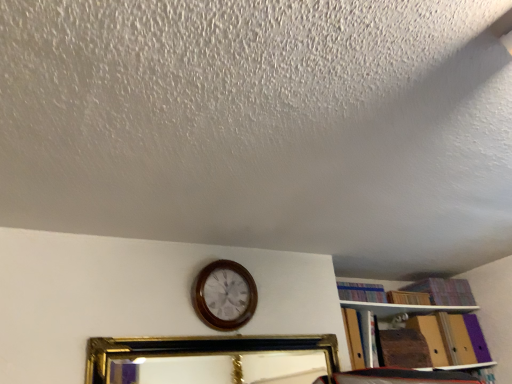
Question: Can you confirm if wooden wall clock at center is positioned to the left of striped fabric book at upper right?

Choices:
 (A) yes
 (B) no

Answer: (A)

Question: Is striped fabric book at upper right completely or partially inside wooden wall clock at center?

Choices:
 (A) yes
 (B) no

Answer: (B)

Question: From a real-world perspective, is wooden wall clock at center on top of striped fabric book at upper right?

Choices:
 (A) yes
 (B) no

Answer: (B)

Question: Considering the relative sizes of wooden wall clock at center and striped fabric book at upper right in the image provided, is wooden wall clock at center wider than striped fabric book at upper right?

Choices:
 (A) no
 (B) yes

Answer: (A)

Question: Is striped fabric book at upper right at the back of wooden wall clock at center?

Choices:
 (A) yes
 (B) no

Answer: (B)

Question: Is wooden wall clock at center closer to the viewer compared to striped fabric book at upper right?

Choices:
 (A) yes
 (B) no

Answer: (A)

Question: Is the surface of striped fabric book at upper right in direct contact with gold/gilded picture frame at center?

Choices:
 (A) no
 (B) yes

Answer: (A)

Question: Is striped fabric book at upper right completely or partially outside of gold/gilded picture frame at center?

Choices:
 (A) yes
 (B) no

Answer: (A)

Question: Is striped fabric book at upper right bigger than gold/gilded picture frame at center?

Choices:
 (A) no
 (B) yes

Answer: (A)

Question: Can you confirm if striped fabric book at upper right is wider than gold/gilded picture frame at center?

Choices:
 (A) yes
 (B) no

Answer: (B)

Question: Could you tell me if striped fabric book at upper right is turned towards gold/gilded picture frame at center?

Choices:
 (A) no
 (B) yes

Answer: (A)

Question: Would you consider striped fabric book at upper right to be distant from gold/gilded picture frame at center?

Choices:
 (A) yes
 (B) no

Answer: (A)

Question: Can you confirm if striped fabric book at upper right is wider than wooden wall clock at center?

Choices:
 (A) no
 (B) yes

Answer: (B)